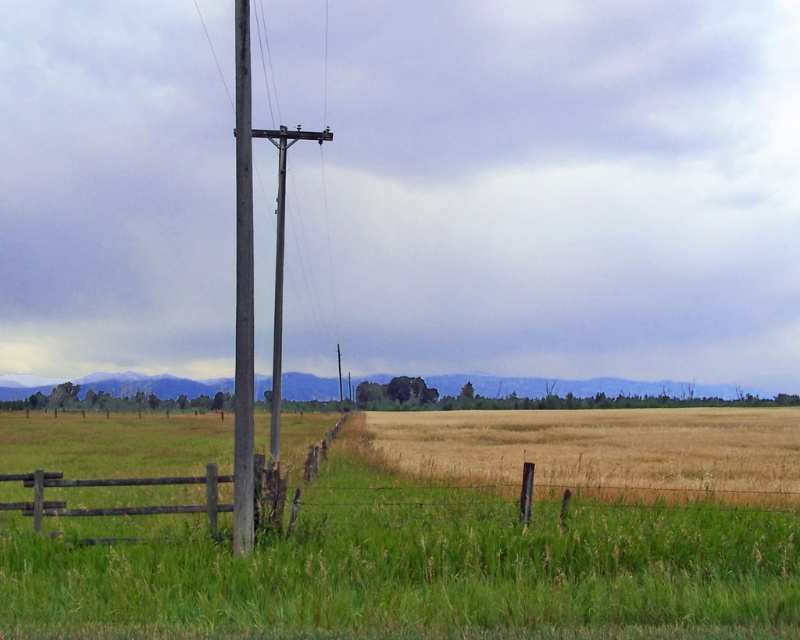
How distant is brown wooden fence at lower left from wooden telegraph pole at left?

The distance of brown wooden fence at lower left from wooden telegraph pole at left is 18.05 meters.

Is point (274, 476) positioned before point (246, 468)?

No.

Which is in front, point (186, 480) or point (250, 120)?

Point (250, 120) is in front.

This screenshot has height=640, width=800. I want to click on brown wooden fence at lower left, so click(x=156, y=492).

Is golden dry grass at center positioned at the back of brown wooden fence at lower left?

Yes, golden dry grass at center is behind brown wooden fence at lower left.

Does point (710, 442) lie behind point (38, 531)?

Yes.

Describe the element at coordinates (602, 451) in the screenshot. I see `golden dry grass at center` at that location.

Where is `golden dry grass at center`? golden dry grass at center is located at coordinates (602, 451).

Which of these two, golden dry grass at center or wooden telegraph pole at left, stands taller?

wooden telegraph pole at left

Image resolution: width=800 pixels, height=640 pixels. Describe the element at coordinates (602, 451) in the screenshot. I see `golden dry grass at center` at that location.

What do you see at coordinates (602, 451) in the screenshot? The width and height of the screenshot is (800, 640). I see `golden dry grass at center` at bounding box center [602, 451].

Locate an element on the screen. golden dry grass at center is located at coordinates (602, 451).